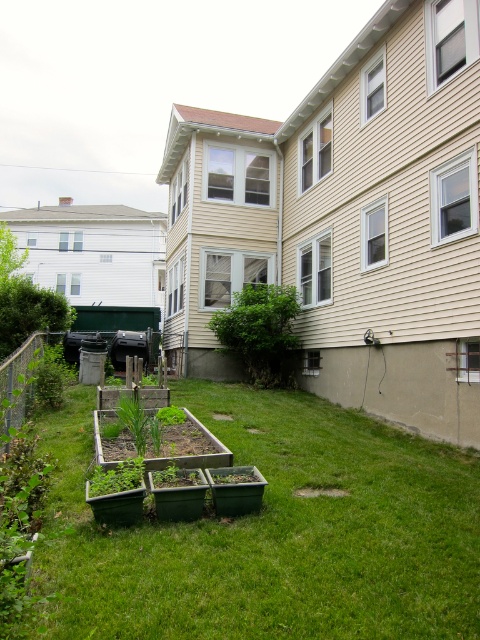
Is green grass at lower center below green leafy bush at center?

Correct, green grass at lower center is located below green leafy bush at center.

This screenshot has height=640, width=480. What do you see at coordinates (271, 532) in the screenshot?
I see `green grass at lower center` at bounding box center [271, 532].

Image resolution: width=480 pixels, height=640 pixels. I want to click on green grass at lower center, so click(x=271, y=532).

Who is lower down, green wooden raised beds at center or green leafy bush at center?

Positioned lower is green wooden raised beds at center.

Can you confirm if green wooden raised beds at center is taller than green leafy bush at center?

In fact, green wooden raised beds at center may be shorter than green leafy bush at center.

Is point (145, 484) farther from viewer compared to point (288, 378)?

No, it is in front of (288, 378).

Locate an element on the screen. green wooden raised beds at center is located at coordinates (202, 476).

Can you confirm if green grass at lower center is taller than green wooden raised beds at center?

No, green grass at lower center is not taller than green wooden raised beds at center.

Is green grass at lower center positioned behind green wooden raised beds at center?

Yes.

Does point (397, 573) come in front of point (213, 435)?

Yes.

What are the coordinates of `green grass at lower center` in the screenshot? It's located at (271, 532).